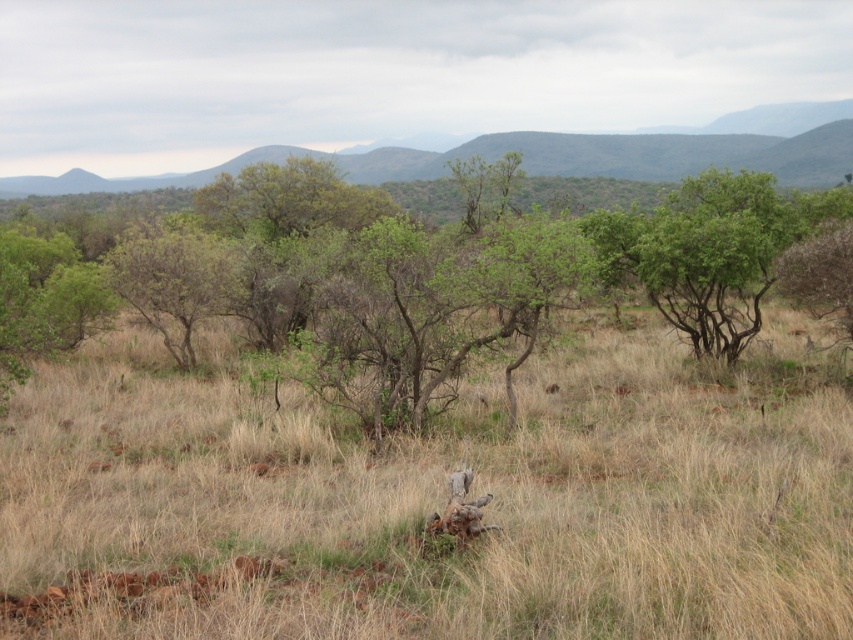
Is green leafy tree at center to the left of green leafy shrub at center from the viewer's perspective?

In fact, green leafy tree at center is to the right of green leafy shrub at center.

Who is more forward, (311, 262) or (126, 246)?

Point (126, 246)

The height and width of the screenshot is (640, 853). I want to click on green leafy tree at center, so click(x=447, y=273).